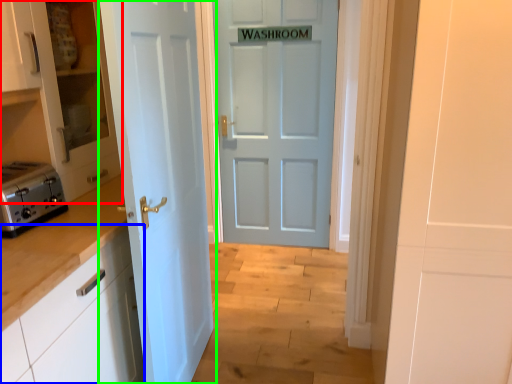
Question: Which is nearer to the cabinetry (highlighted by a red box)? cabinetry (highlighted by a blue box) or door (highlighted by a green box).

Choices:
 (A) cabinetry
 (B) door

Answer: (B)